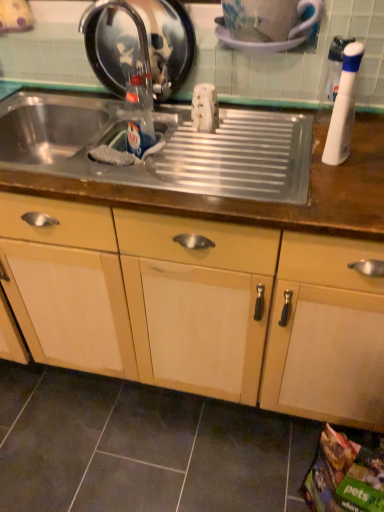
Question: From their relative heights in the image, would you say metallic stainless steel tray at center is taller or shorter than clear glass bottle at center, which ranks as the 2th bottle in right-to-left order?

Choices:
 (A) short
 (B) tall

Answer: (A)

Question: From a real-world perspective, is metallic stainless steel tray at center positioned above or below clear glass bottle at center, which ranks as the 2th bottle in right-to-left order?

Choices:
 (A) above
 (B) below

Answer: (B)

Question: Which of these objects is positioned farthest from the metallic stainless steel tray at center?

Choices:
 (A) clear glass bottle at center, arranged as the first bottle when viewed from the left
 (B) white plastic bottle at right, placed as the 2th bottle when sorted from left to right
 (C) satin nickel faucet at upper left
 (D) glossy ceramic mug at upper center
 (E) matte wood cabinet at center

Answer: (D)

Question: Which object is positioned closest to the metallic stainless steel tray at center?

Choices:
 (A) white plastic bottle at right, which ranks as the 1th bottle in front-to-back order
 (B) clear glass bottle at center, which ranks as the 2th bottle in right-to-left order
 (C) satin nickel faucet at upper left
 (D) matte wood cabinet at center
 (E) glossy ceramic mug at upper center

Answer: (B)